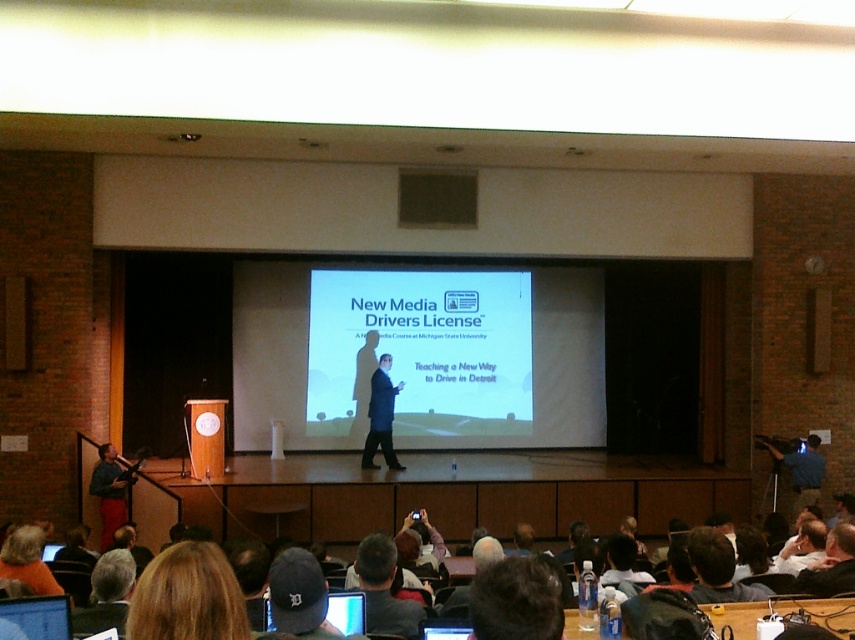
In the lecture hall scene, there is a white matte projection screen at center and a wooden podium with a circular emblem on the left side of the stage. Where is the point located at coordinates (422, 349) in relation to these two objects?

The point at coordinates (422, 349) corresponds to the white matte projection screen at center.